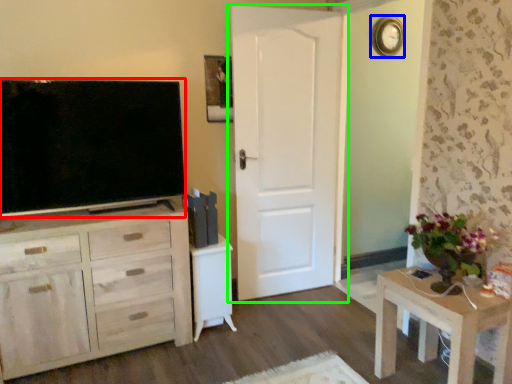
Question: Based on their relative distances, which object is farther from television (highlighted by a red box)? Choose from clock (highlighted by a blue box) and door (highlighted by a green box).

Choices:
 (A) clock
 (B) door

Answer: (A)